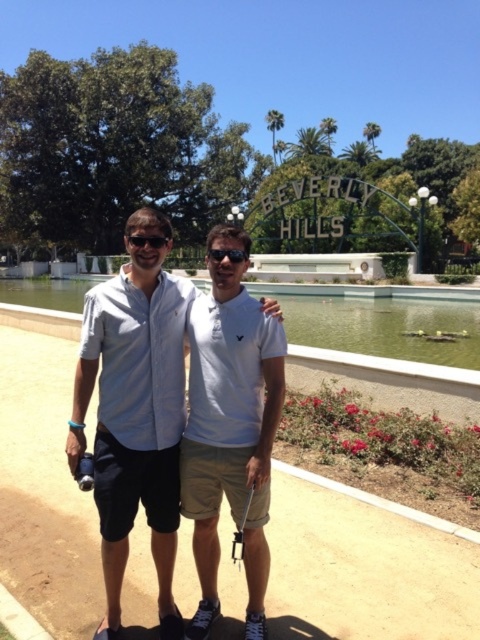
Question: Which point is closer to the camera taking this photo?

Choices:
 (A) (240, 253)
 (B) (105, 513)
 (C) (455, 348)
 (D) (143, 237)

Answer: (B)

Question: Among these points, which one is farthest from the camera?

Choices:
 (A) (236, 256)
 (B) (441, 314)
 (C) (160, 244)
 (D) (141, 436)

Answer: (B)

Question: Is white cotton shirt at center smaller than matte black sunglasses at center?

Choices:
 (A) yes
 (B) no

Answer: (B)

Question: Based on their relative distances, which object is nearer to the white cotton shirt at center?

Choices:
 (A) matte black sunglasses at center
 (B) green glass pond at center
 (C) matte black goggles at center
 (D) white cotton polo shirt at center

Answer: (C)

Question: Does matte black sunglasses at center appear over matte black goggles at center?

Choices:
 (A) no
 (B) yes

Answer: (B)

Question: Does white cotton polo shirt at center appear under matte black goggles at center?

Choices:
 (A) yes
 (B) no

Answer: (B)